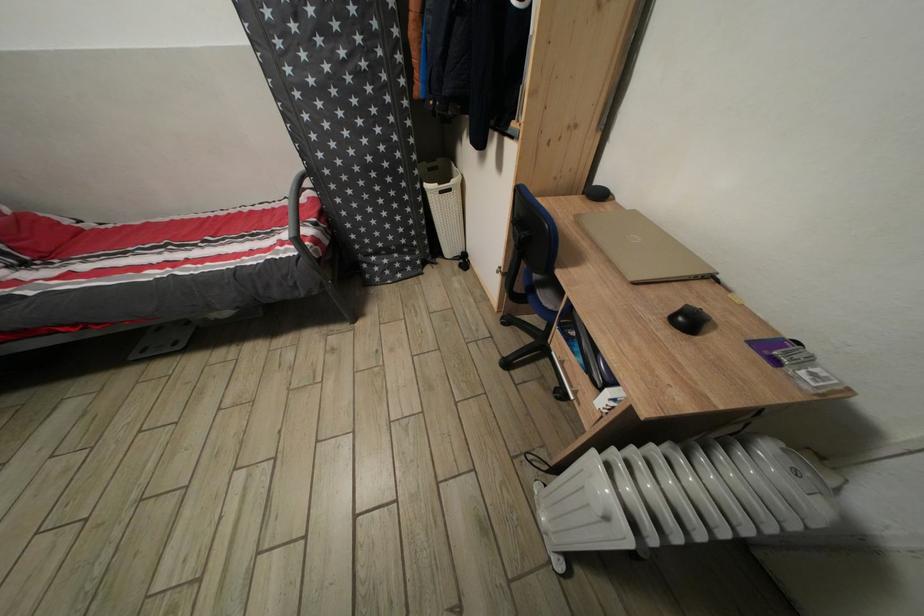
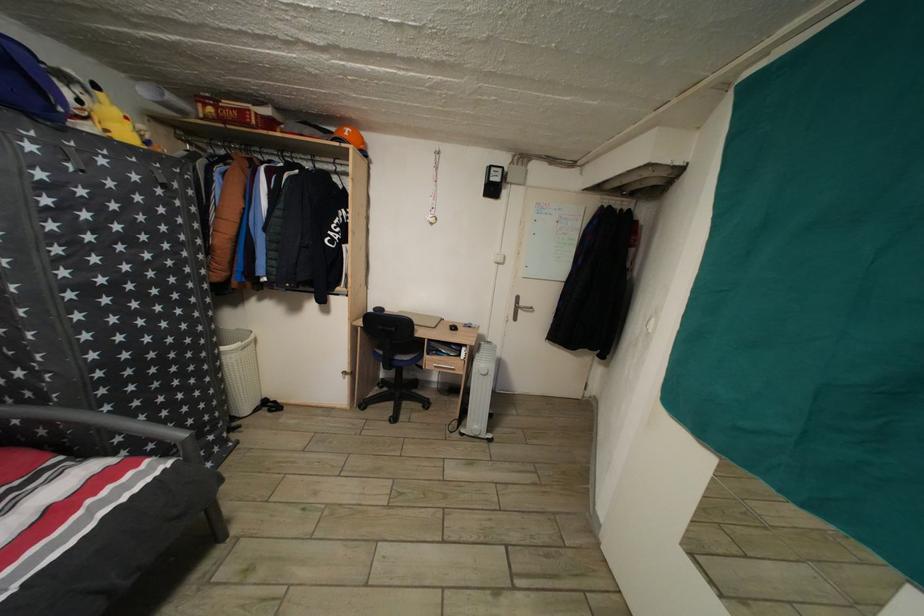
Find the pixel in the second image that matches point (285, 254) in the first image.

(96, 508)